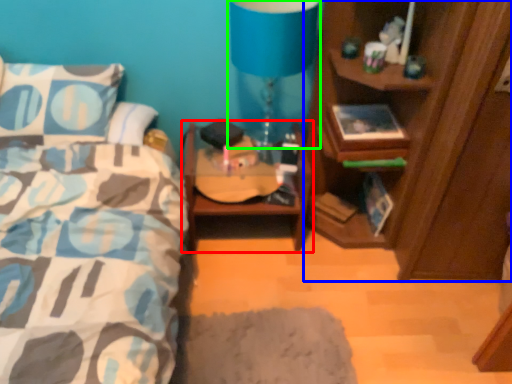
Question: Estimate the real-world distances between objects in this image. Which object is closer to nightstand (highlighted by a red box), cabinetry (highlighted by a blue box) or table lamp (highlighted by a green box)?

Choices:
 (A) cabinetry
 (B) table lamp

Answer: (A)